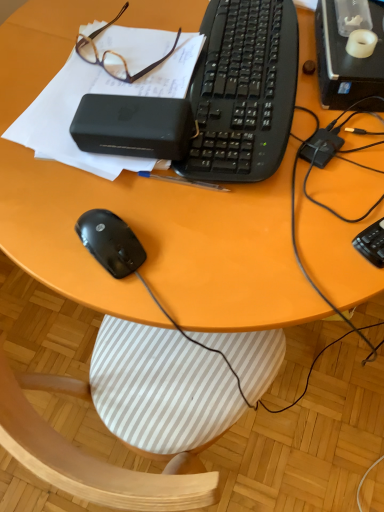
Image resolution: width=384 pixels, height=512 pixels. Identify the location of vacant space in front of black plastic power bank at upper center. (154, 232).